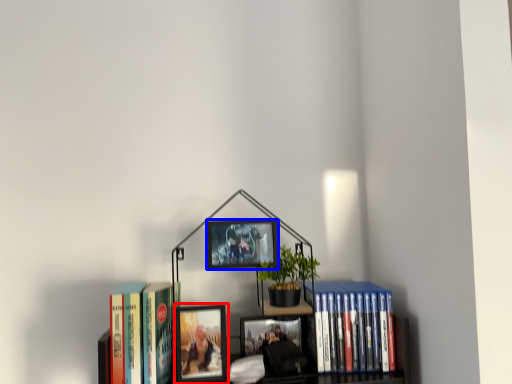
Question: Which point is further to the camera, picture frame (highlighted by a red box) or picture frame (highlighted by a blue box)?

Choices:
 (A) picture frame
 (B) picture frame

Answer: (B)